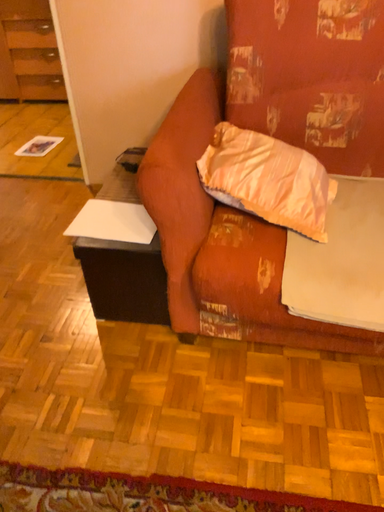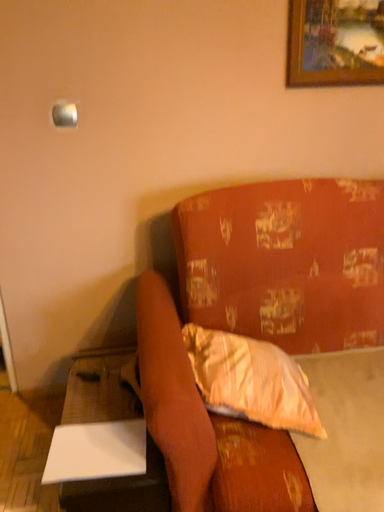
Question: How did the camera likely rotate when shooting the video?

Choices:
 (A) rotated left
 (B) rotated right

Answer: (B)